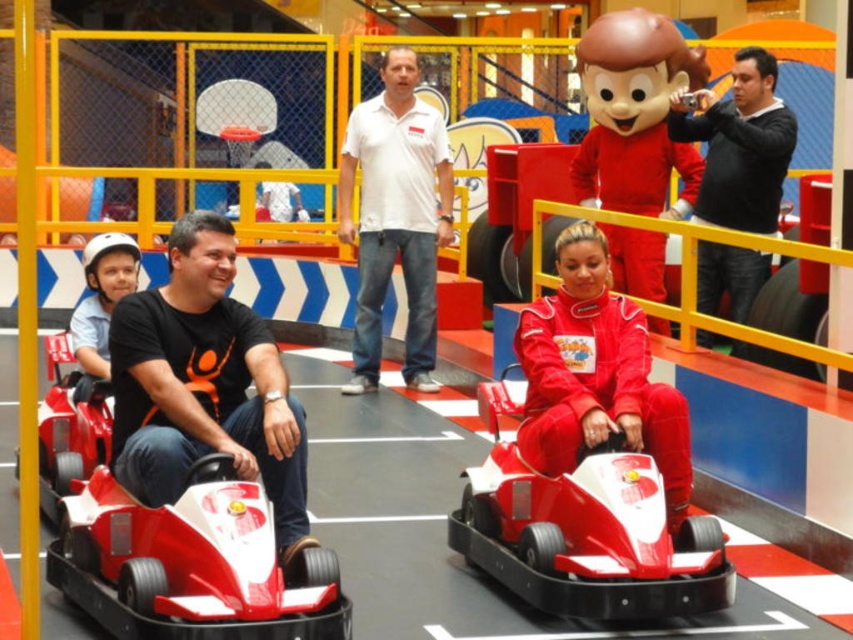
You are standing in the go karting area and want to take a photo of the shiny red race car at center. If your camera can focus on objects up to 5 meters away, will you be able to take a clear photo?

The shiny red race car at center is 5.59 meters away from the viewer. Since the camera can only focus up to 5 meters, you will not be able to take a clear photo.